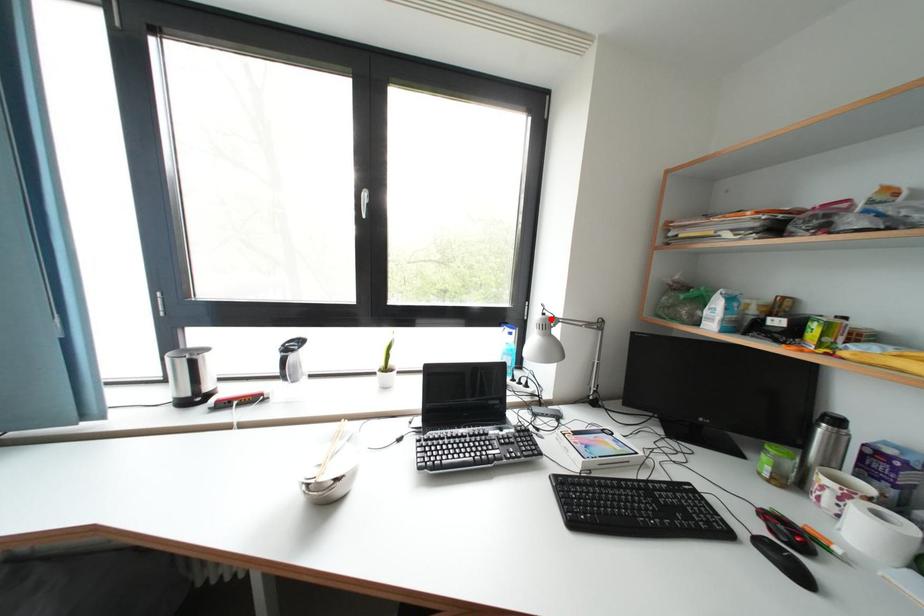
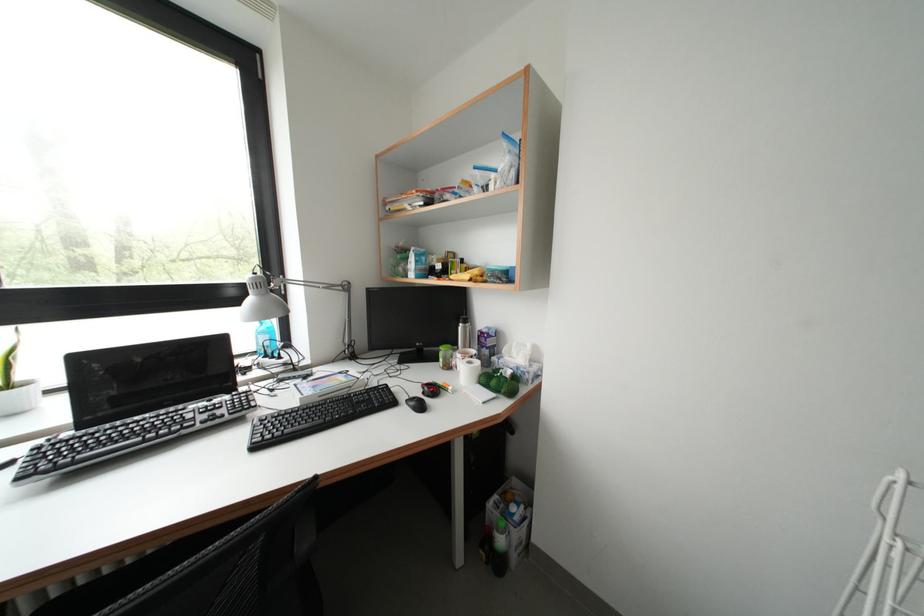
Locate, in the second image, the point that corresponds to the highlighted location in the first image.

(261, 278)